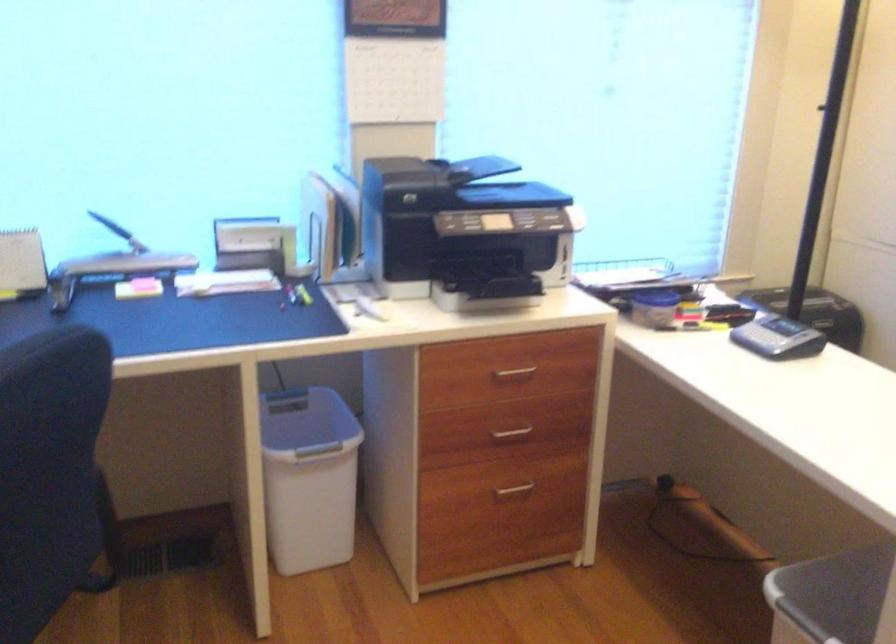
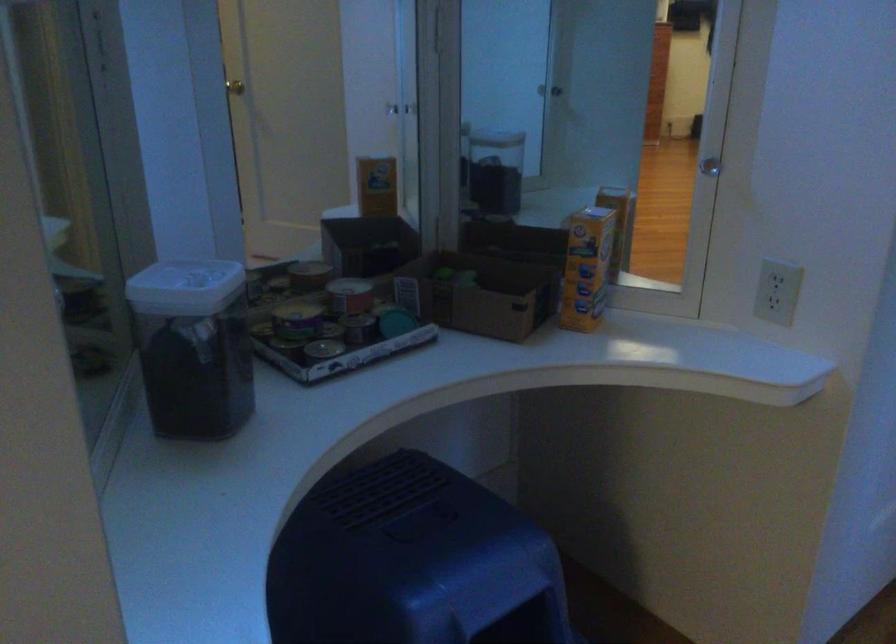
What movement of the cameraman would produce the second image?

The cameraman moved toward right, forward.